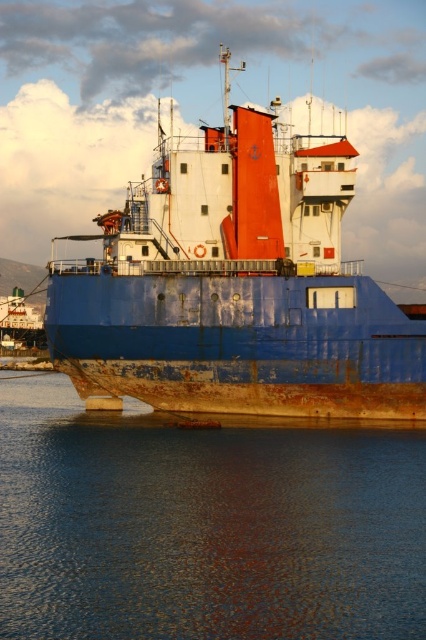
You are an inspector on the deck of the rusty metal ship at center. You notice something unusual about the position of the rusty metallic water at lower center. What might you be observing?

The rusty metallic water at lower center is located below the rusty metal ship at center, which could indicate that the water level has risen or the ship is sinking, causing the water to be positioned lower than the ship.

You are standing on the deck of the cargo ship and notice a specific point marked at coordinates (204, 525). What object is located at this point?

The rusty metallic water at lower center is located at point (204, 525).

You are a port inspector checking the docking position of the cargo ship. According to the image, where is the rusty metallic water at lower center located in relation to the rusty metal ship at center?

The rusty metallic water at lower center is positioned on the right side of the rusty metal ship at center.